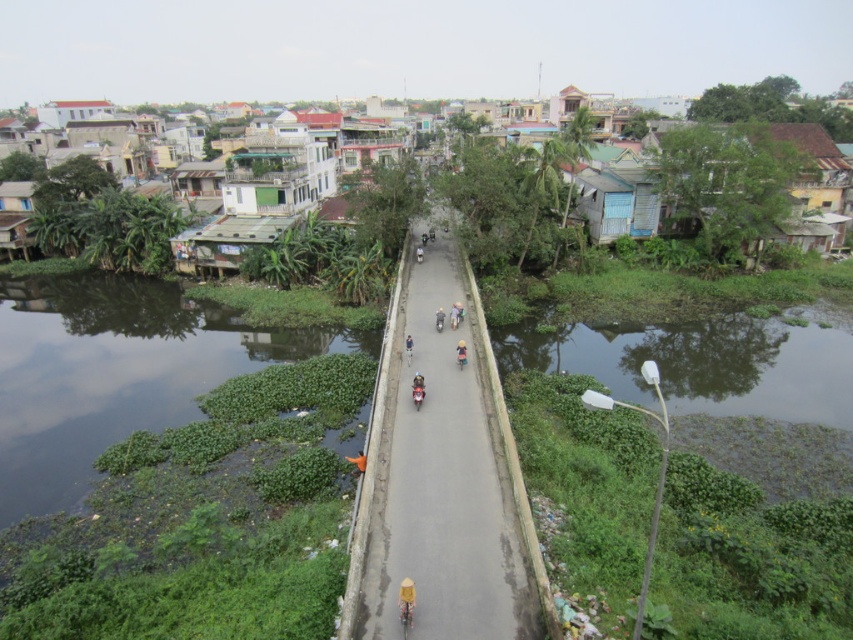
Which of these two, green algae-covered water at lower right or blue fabric bicycle at center, stands shorter?

With less height is blue fabric bicycle at center.

Can you confirm if green algae-covered water at lower right is shorter than blue fabric bicycle at center?

No, green algae-covered water at lower right is not shorter than blue fabric bicycle at center.

At what (x,y) coordinates should I click in order to perform the action: click on green algae-covered water at lower right. Please return your answer as a coordinate pair (x, y). Looking at the image, I should click on (705, 360).

Is point (120, 340) behind point (567, 348)?

Yes, it is behind point (567, 348).

Is green algae at lower left taller than green algae-covered water at lower right?

Yes.

Is point (227, 376) behind point (791, 369)?

That is False.

Locate an element on the screen. This screenshot has width=853, height=640. green algae at lower left is located at coordinates (114, 372).

Consider the image. Which is above, orange fabric at center or blue fabric bicycle at center?

blue fabric bicycle at center is higher up.

Does orange fabric at center have a greater width compared to blue fabric bicycle at center?

Incorrect, orange fabric at center's width does not surpass blue fabric bicycle at center's.

Image resolution: width=853 pixels, height=640 pixels. I want to click on orange fabric at center, so click(357, 461).

Locate an element on the screen. The width and height of the screenshot is (853, 640). orange fabric at center is located at coordinates (357, 461).